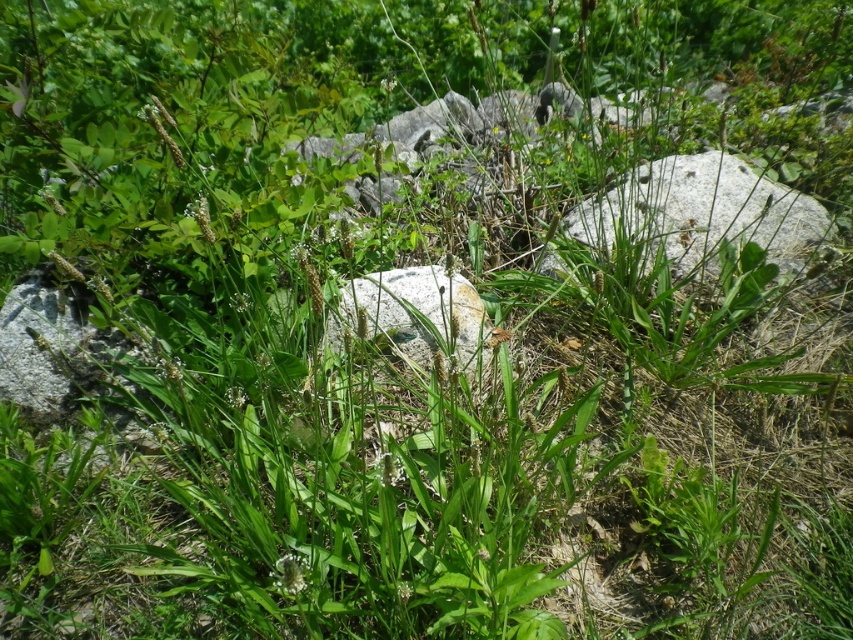
Question: Among these objects, which one is nearest to the camera?

Choices:
 (A) smooth gray rock at center
 (B) gray rough stone at center

Answer: (A)

Question: Which point appears closest to the camera in this image?

Choices:
 (A) (630, 227)
 (B) (323, 337)

Answer: (B)

Question: Is gray rough stone at center further to camera compared to smooth gray rock at center?

Choices:
 (A) yes
 (B) no

Answer: (A)

Question: From the image, what is the correct spatial relationship of gray rough stone at center in relation to smooth gray rock at center?

Choices:
 (A) left
 (B) right

Answer: (B)

Question: From the image, what is the correct spatial relationship of gray rough stone at center in relation to smooth gray rock at center?

Choices:
 (A) left
 (B) right

Answer: (B)